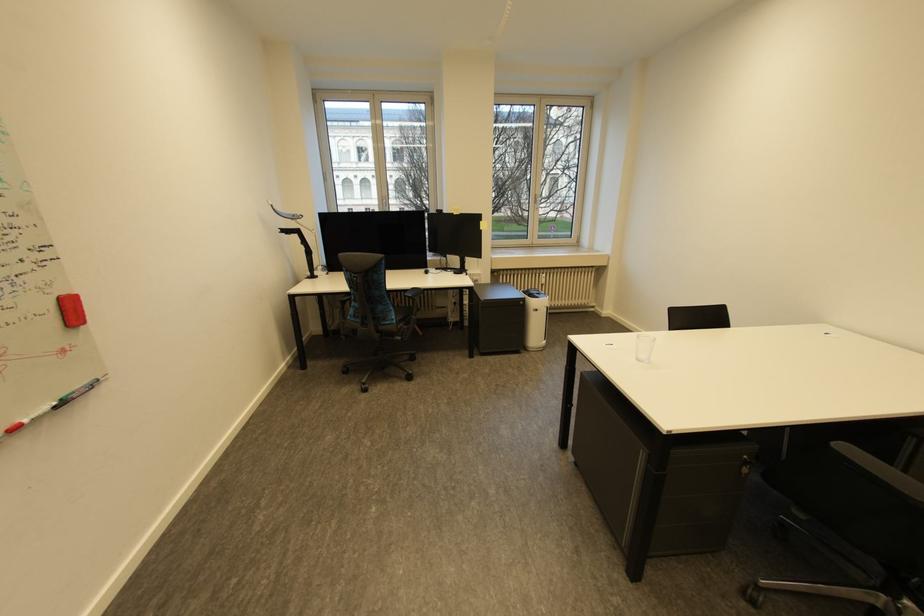
The height and width of the screenshot is (616, 924). What do you see at coordinates (71, 310) in the screenshot?
I see `a red whiteboard eraser` at bounding box center [71, 310].